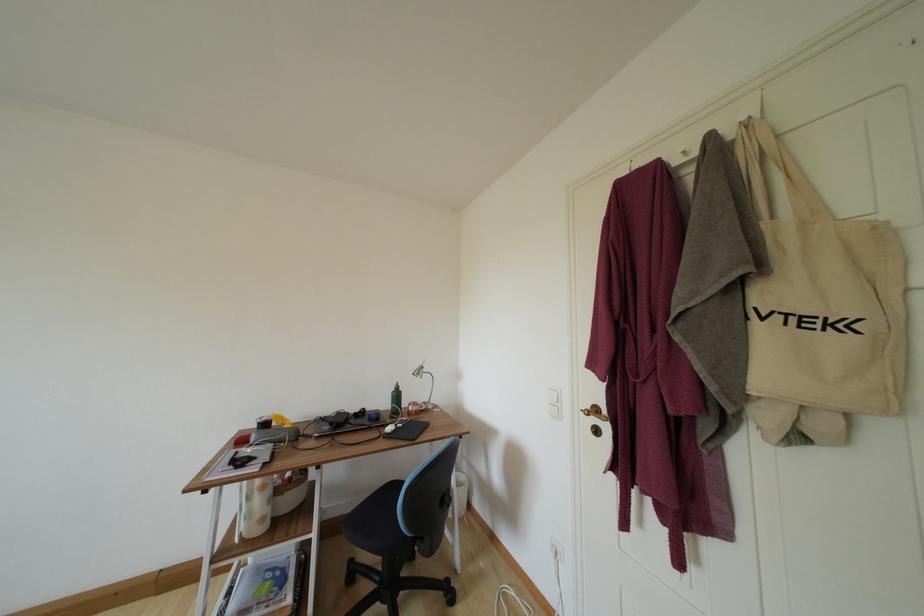
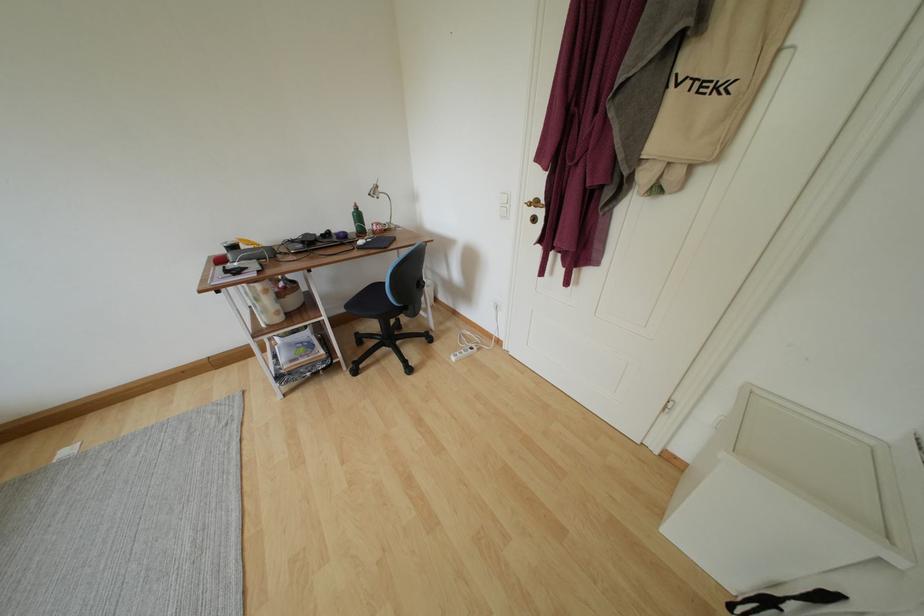
In the second image, find the point that corresponds to [402,400] in the first image.

(363, 220)